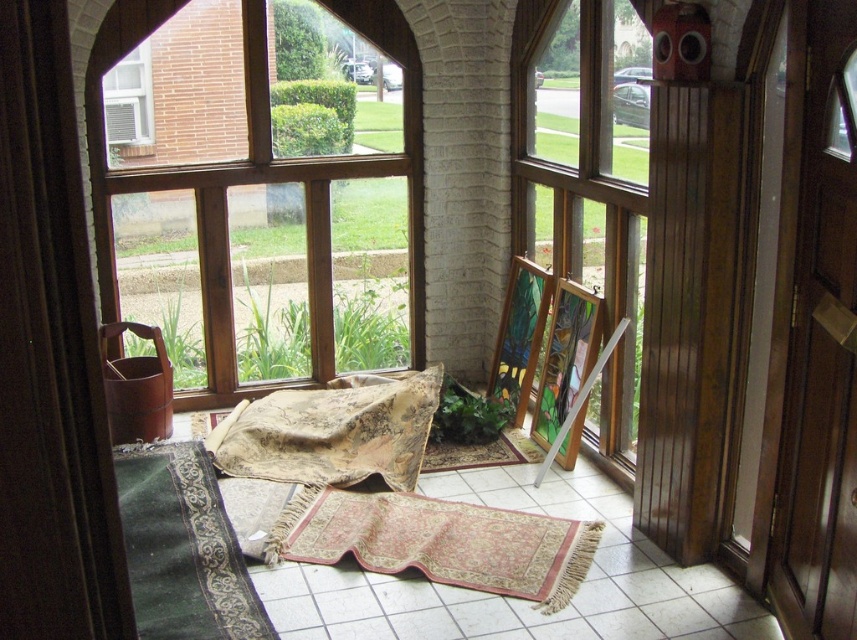
Question: Is beige woven mat at center bigger than dark green textured rug at lower left?

Choices:
 (A) yes
 (B) no

Answer: (B)

Question: Considering the real-world distances, which object is farthest from the wooden frame at left?

Choices:
 (A) white plastic air conditioner at upper left
 (B) beige woven mat at center

Answer: (B)

Question: Which point is farther to the camera?

Choices:
 (A) brown wooden screen door at right
 (B) dark green textured rug at lower left
 (C) rug with intricate patterns at center
 (D) wooden frame at left

Answer: (D)

Question: Does brown wooden screen door at right appear over white plastic air conditioner at upper left?

Choices:
 (A) no
 (B) yes

Answer: (A)

Question: Among these points, which one is nearest to the camera?

Choices:
 (A) (820, 620)
 (B) (333, 394)
 (C) (144, 557)

Answer: (A)

Question: Does beige woven mat at center appear under woven fabric at center?

Choices:
 (A) no
 (B) yes

Answer: (B)